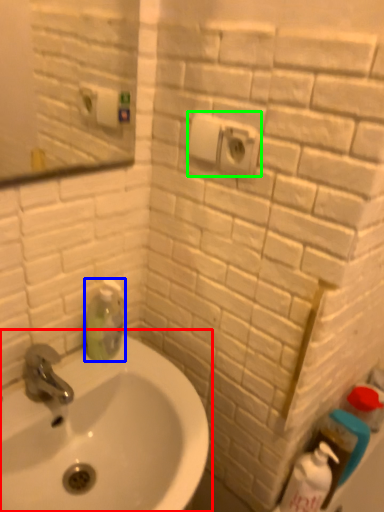
Question: Which object is the closest to the sink (highlighted by a red box)? Choose among these: cleaning product (highlighted by a blue box) or electric outlet (highlighted by a green box).

Choices:
 (A) cleaning product
 (B) electric outlet

Answer: (A)